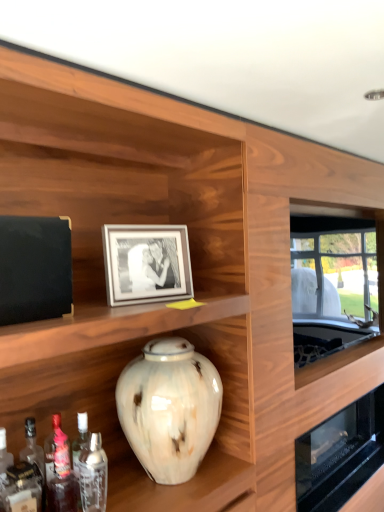
Question: From a real-world perspective, is translucent glass bottle at lower left, marked as the second bottle in a right-to-left arrangement, below clear glass bottle at lower left, the second bottle positioned from the left?

Choices:
 (A) no
 (B) yes

Answer: (A)

Question: Considering the relative sizes of translucent glass bottle at lower left, which appears as the first bottle when viewed from the left, and clear glass bottle at lower left, the second bottle positioned from the left, in the image provided, is translucent glass bottle at lower left, which appears as the first bottle when viewed from the left, wider than clear glass bottle at lower left, the second bottle positioned from the left,?

Choices:
 (A) no
 (B) yes

Answer: (A)

Question: From a real-world perspective, does translucent glass bottle at lower left, which appears as the first bottle when viewed from the left, stand above clear glass bottle at lower left, acting as the 1th bottle starting from the right?

Choices:
 (A) yes
 (B) no

Answer: (A)

Question: Does translucent glass bottle at lower left, which appears as the first bottle when viewed from the left, turn towards clear glass bottle at lower left, the second bottle positioned from the left?

Choices:
 (A) yes
 (B) no

Answer: (B)

Question: Would you say marbled ceramic vase at center is to the left or to the right of clear glass bottle at lower left, acting as the 1th bottle starting from the right, in the picture?

Choices:
 (A) right
 (B) left

Answer: (A)

Question: In terms of height, does marbled ceramic vase at center look taller or shorter compared to clear glass bottle at lower left, the second bottle positioned from the left?

Choices:
 (A) tall
 (B) short

Answer: (A)

Question: Considering their positions, is marbled ceramic vase at center located in front of or behind clear glass bottle at lower left, acting as the 1th bottle starting from the right?

Choices:
 (A) behind
 (B) front

Answer: (A)

Question: Choose the correct answer: Is marbled ceramic vase at center inside clear glass bottle at lower left, the second bottle positioned from the left, or outside it?

Choices:
 (A) inside
 (B) outside

Answer: (B)

Question: Considering the positions of matte silver picture frame at center and marbled ceramic vase at center in the image, is matte silver picture frame at center taller or shorter than marbled ceramic vase at center?

Choices:
 (A) short
 (B) tall

Answer: (A)

Question: In the image, is matte silver picture frame at center on the left side or the right side of marbled ceramic vase at center?

Choices:
 (A) left
 (B) right

Answer: (A)

Question: Considering their positions, is matte silver picture frame at center located in front of or behind marbled ceramic vase at center?

Choices:
 (A) behind
 (B) front

Answer: (A)

Question: In terms of size, does matte silver picture frame at center appear bigger or smaller than marbled ceramic vase at center?

Choices:
 (A) big
 (B) small

Answer: (B)

Question: From the image's perspective, relative to marbled ceramic vase at center, is clear glass bottle at lower left, acting as the 1th bottle starting from the right, above or below?

Choices:
 (A) below
 (B) above

Answer: (A)

Question: Considering the positions of clear glass bottle at lower left, acting as the 1th bottle starting from the right, and marbled ceramic vase at center in the image, is clear glass bottle at lower left, acting as the 1th bottle starting from the right, bigger or smaller than marbled ceramic vase at center?

Choices:
 (A) big
 (B) small

Answer: (B)